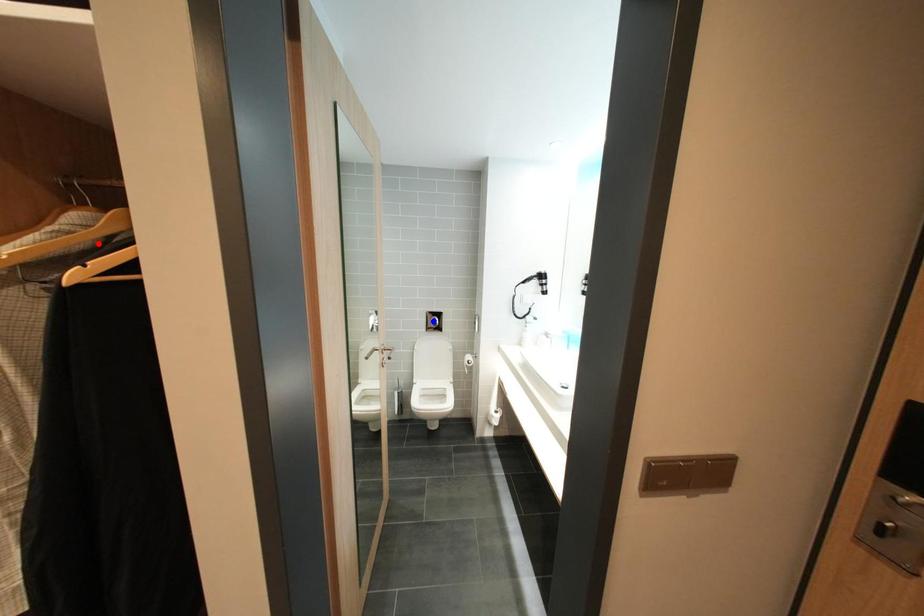
Question: Two points are marked on the image. Which point is closer to the camera?

Choices:
 (A) Blue point is closer.
 (B) Red point is closer.

Answer: (B)